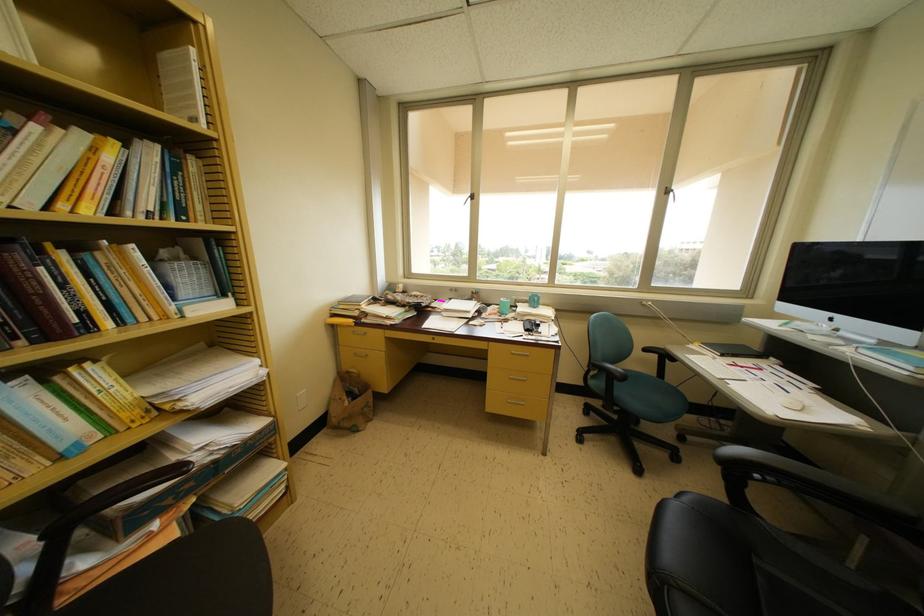
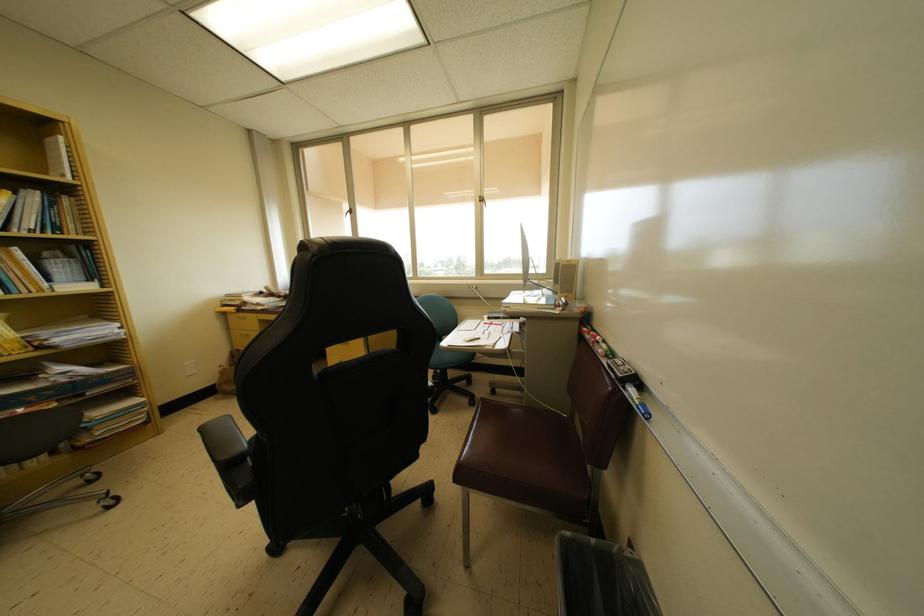
Question: What movement of the cameraman would produce the second image?

Choices:
 (A) Left
 (B) Right
 (C) Forward
 (D) Backward

Answer: (B)